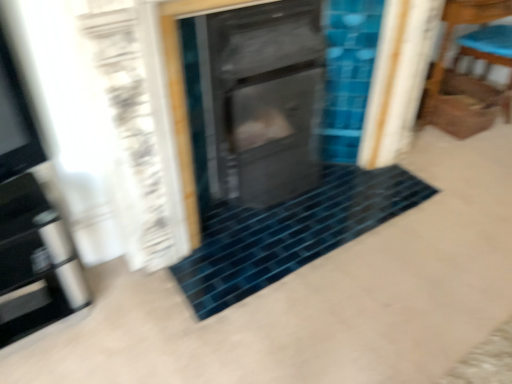
This screenshot has height=384, width=512. What do you see at coordinates (462, 77) in the screenshot?
I see `blue fabric chair at upper right` at bounding box center [462, 77].

Locate an element on the screen. blue fabric chair at upper right is located at coordinates (462, 77).

The image size is (512, 384). I want to click on blue fabric chair at upper right, so click(462, 77).